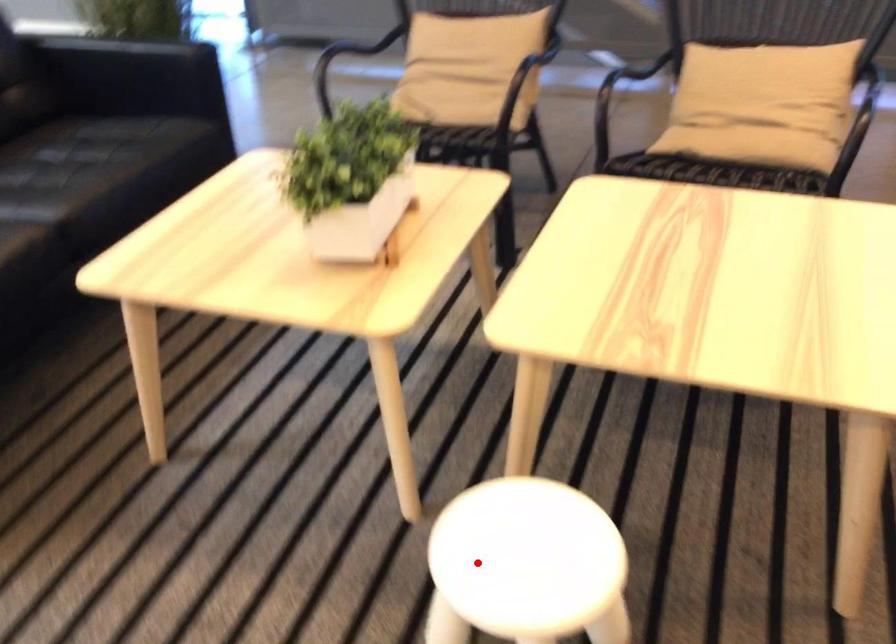
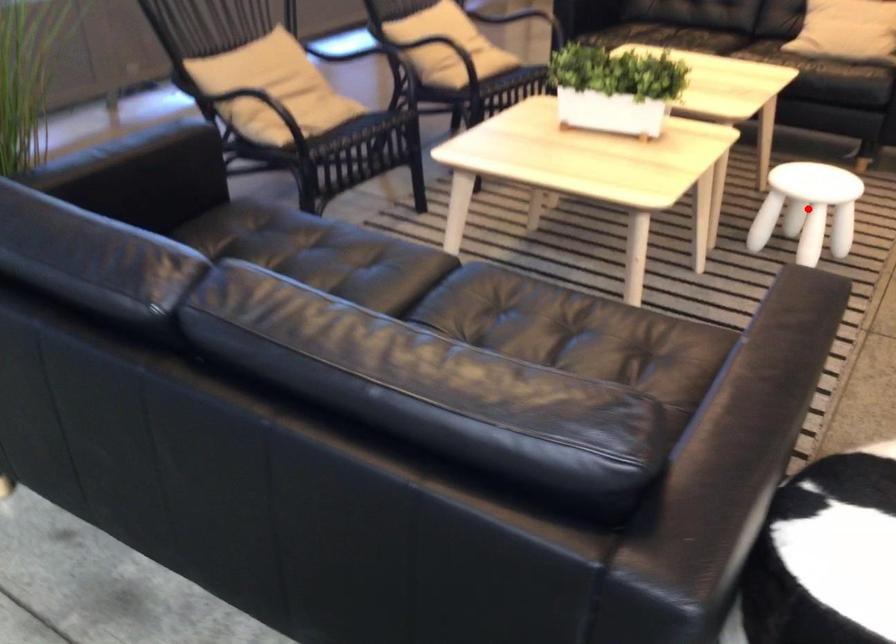
I am providing you with two images of the same scene from different viewpoints. A red point is marked on the first image and another point is marked on the second image. Do the highlighted points in image1 and image2 indicate the same real-world spot?

Yes